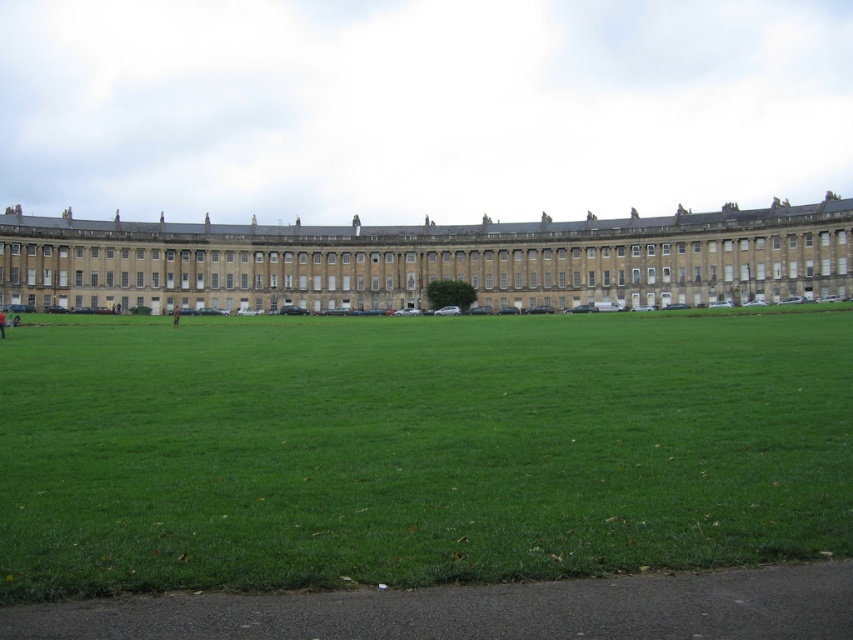
Does green grass at center have a smaller size compared to beige stone palace at center?

No.

Which is in front, point (544, 564) or point (688, 282)?

Point (544, 564)

The width and height of the screenshot is (853, 640). Describe the element at coordinates (418, 449) in the screenshot. I see `green grass at center` at that location.

Locate an element on the screen. green grass at center is located at coordinates (418, 449).